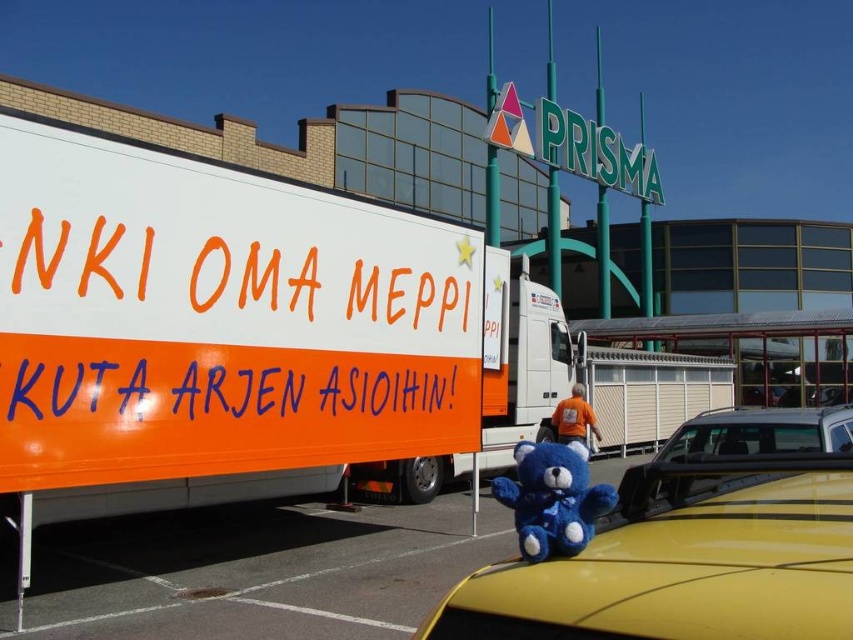
Which is in front, point (120, 282) or point (529, 516)?

Point (529, 516) is in front.

The width and height of the screenshot is (853, 640). Describe the element at coordinates (241, 332) in the screenshot. I see `orange matte trailer truck at left` at that location.

Does point (215, 348) lie behind point (521, 509)?

Yes.

In order to click on orange matte trailer truck at left in this screenshot , I will do `click(241, 332)`.

Does point (271, 492) come closer to viewer compared to point (813, 442)?

No, (271, 492) is further to viewer.

Does orange matte trailer truck at left have a greater height compared to metallic silver car at lower right?

No, orange matte trailer truck at left is not taller than metallic silver car at lower right.

Does point (221, 337) lie in front of point (747, 412)?

Yes, point (221, 337) is in front of point (747, 412).

At what (x,y) coordinates should I click in order to perform the action: click on orange matte trailer truck at left. Please return your answer as a coordinate pair (x, y). Looking at the image, I should click on (241, 332).

Can you confirm if orange matte trailer truck at left is positioned above blue plush toy at center?

Actually, orange matte trailer truck at left is below blue plush toy at center.

Between orange matte trailer truck at left and blue plush toy at center, which one has less height?

blue plush toy at center is shorter.

You are a GUI agent. You are given a task and a screenshot of the screen. Output one action in this format:
    pyautogui.click(x=<x>, y=<y>)
    Task: Click on the orange matte trailer truck at left
    
    Given the screenshot: What is the action you would take?
    pyautogui.click(x=241, y=332)